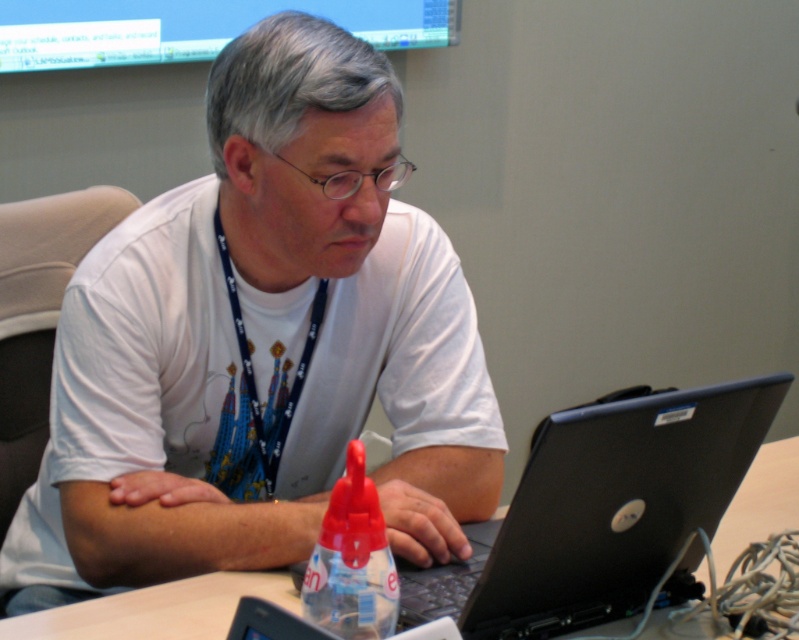
You are a photographer standing in front of the scene. You want to capture a photo where both the white matte table at center and the transparent plastic bottle at center are clearly visible. Which object should you focus on first to ensure both are in focus?

Since the white matte table at center is closer to you than the transparent plastic bottle at center, you should focus on the white matte table at center first. This way, the transparent plastic bottle at center will be within the depth of field and still appear sharp in the photo.

You are organizing a presentation and need to place a large binder on the desk. The binder is wider than the laptop. Based on the scene, can the binder fit on the white matte table at center without overlapping the black plastic laptop at center?

The black plastic laptop at center has a lesser width compared to white matte table at center, so the binder, being wider than the laptop, can fit on the white matte table at center as long as there is enough space allocated for it.

You are organizing a photo shoot and need to ensure proper lighting. The scene includes a white matte shirt at center and a white matte table at center. Which object should be lit more to make it stand out against the other?

The white matte shirt at center should be lit more because it is positioned to the left of the white matte table at center, so adjusting the lighting on the shirt can create contrast and make it stand out against the table.